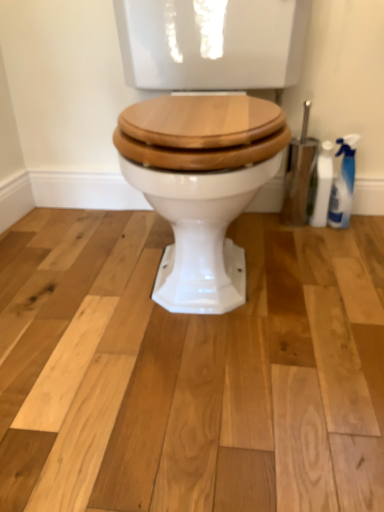
Where is `free space in front of translucent plastic spray bottle at right, the 2th cleaning product from the left`? The width and height of the screenshot is (384, 512). free space in front of translucent plastic spray bottle at right, the 2th cleaning product from the left is located at coordinates (343, 250).